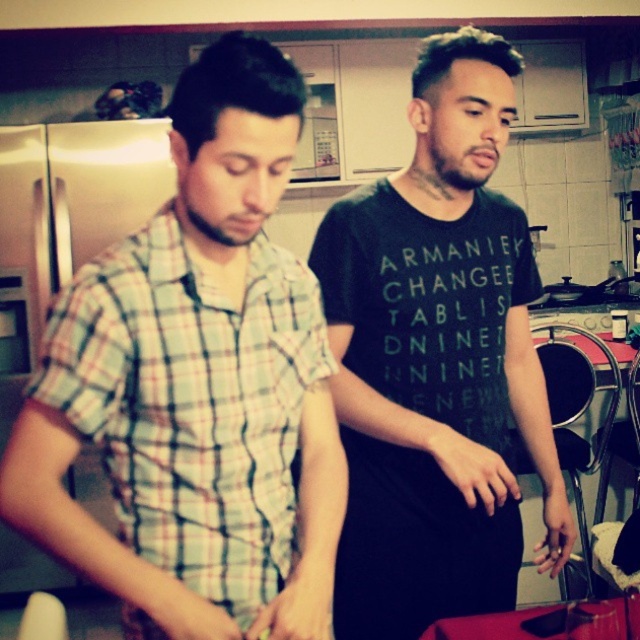
You are standing in the kitchen and want to reach both the point at coordinates [336,456] and the point at coordinates [406,188]. Which point should you reach for first to minimize the distance walked?

You should reach for the point at coordinates [336,456] first because it is closer to you than the point at coordinates [406,188].